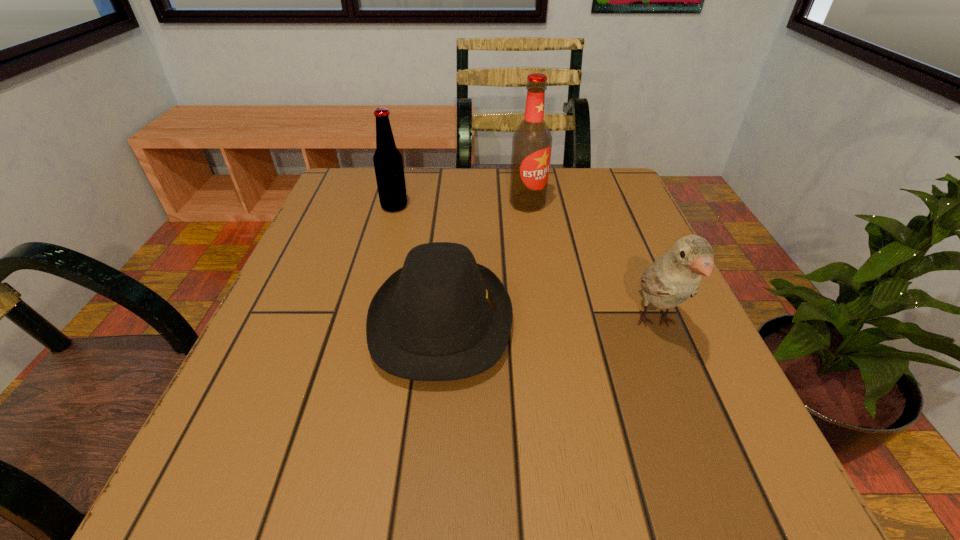
Find the location of a particular element. free space between the taller beer bottle and the left beer bottle is located at coordinates (461, 205).

Find the location of a particular element. The width and height of the screenshot is (960, 540). free area in between the taller beer bottle and the bird is located at coordinates (591, 263).

Where is `vacant region between the rightmost object and the left beer bottle`? The height and width of the screenshot is (540, 960). vacant region between the rightmost object and the left beer bottle is located at coordinates (525, 265).

I want to click on blank region between the shorter beer bottle and the bird, so click(525, 265).

Where is `free space between the fedora and the third object from left to right`? free space between the fedora and the third object from left to right is located at coordinates (484, 262).

This screenshot has width=960, height=540. I want to click on vacant point located between the rightmost object and the fedora, so click(548, 322).

Where is `vacant area between the shorter beer bottle and the rightmost object`? The image size is (960, 540). vacant area between the shorter beer bottle and the rightmost object is located at coordinates (525, 265).

Identify the location of vacant area that lies between the tallest object and the shortest object. This screenshot has width=960, height=540. (484, 262).

The width and height of the screenshot is (960, 540). I want to click on object that ranks as the third closest to the bird, so click(388, 164).

Locate an element on the screen. object that is the second closest one to the tallest object is located at coordinates (388, 164).